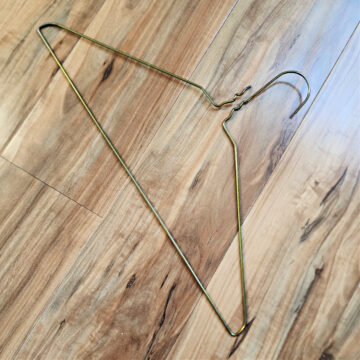
Identify the location of joint between slats on furthest right. The image size is (360, 360). (269, 177).